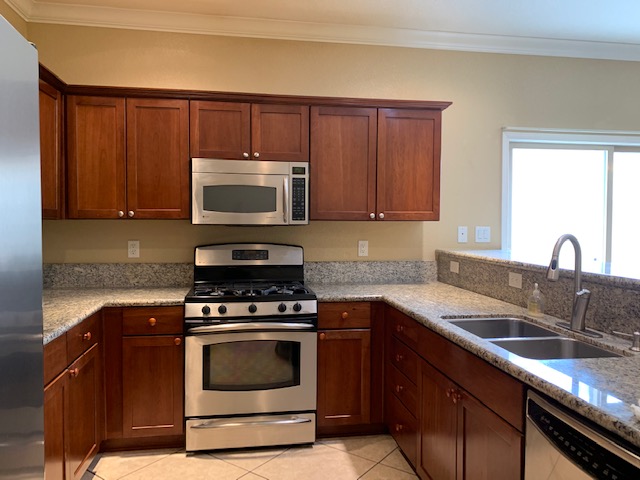
Locate an element on the screen. This screenshot has width=640, height=480. ceiling is located at coordinates (396, 12), (596, 11).